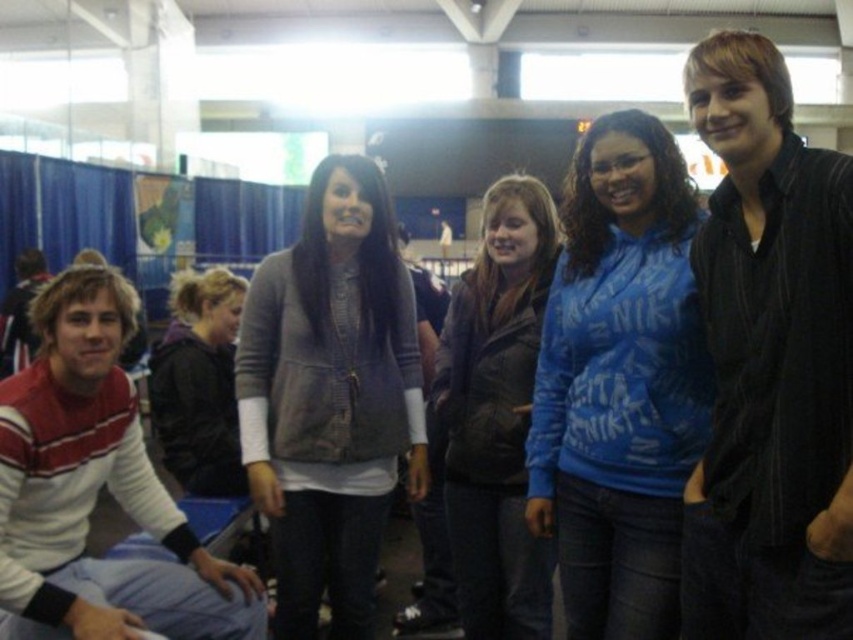
Question: Is matte gray jacket at center to the right of black leather jacket at lower left from the viewer's perspective?

Choices:
 (A) no
 (B) yes

Answer: (B)

Question: Can you confirm if blue cotton hoodie at center is smaller than red and white striped sweater at left?

Choices:
 (A) no
 (B) yes

Answer: (B)

Question: Which point is farther from the camera taking this photo?

Choices:
 (A) (514, 481)
 (B) (94, 314)
 (C) (244, 340)
 (D) (845, 184)

Answer: (A)

Question: Which point appears closest to the camera in this image?

Choices:
 (A) (523, 234)
 (B) (131, 561)
 (C) (219, 285)

Answer: (B)

Question: Can you confirm if matte gray jacket at center is positioned to the left of matte brown jacket at center?

Choices:
 (A) yes
 (B) no

Answer: (A)

Question: Which point is farther to the camera?

Choices:
 (A) (840, 378)
 (B) (476, 403)
 (C) (585, 627)

Answer: (B)